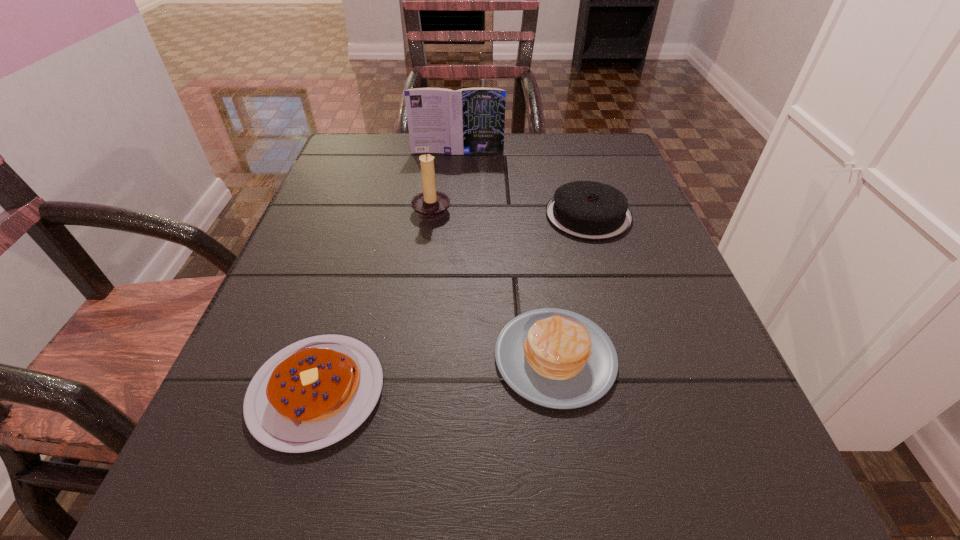
The image size is (960, 540). Identify the location of book. (471, 120).

In order to click on candle holder in this screenshot , I will do `click(430, 205)`.

You are a GUI agent. You are given a task and a screenshot of the screen. Output one action in this format:
    pyautogui.click(x=<x>, y=<y>)
    Task: Click on the farthest pancake
    
    Given the screenshot: What is the action you would take?
    pyautogui.click(x=586, y=210)

This screenshot has width=960, height=540. Find the location of `the shortest pancake`. the shortest pancake is located at coordinates (313, 393).

This screenshot has height=540, width=960. What are the coordinates of `the shortest object` in the screenshot? It's located at (313, 393).

What are the coordinates of `blank area located 0.110m on the front cover of the farthest object` in the screenshot? It's located at (455, 179).

I want to click on free space located on the wick of the candle holder, so click(x=647, y=208).

Where is `vacant space located on the front of the farthest pancake`? vacant space located on the front of the farthest pancake is located at coordinates (643, 401).

Find the location of a particular element. The height and width of the screenshot is (540, 960). free point located 0.070m on the back of the leftmost pancake is located at coordinates (343, 304).

Image resolution: width=960 pixels, height=540 pixels. I want to click on object present at the far edge, so click(471, 120).